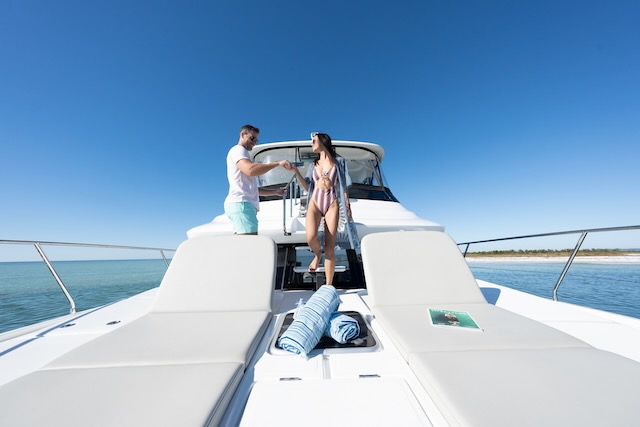
The image size is (640, 427). In order to click on white recliner in this screenshot , I will do `click(179, 336)`, `click(438, 369)`.